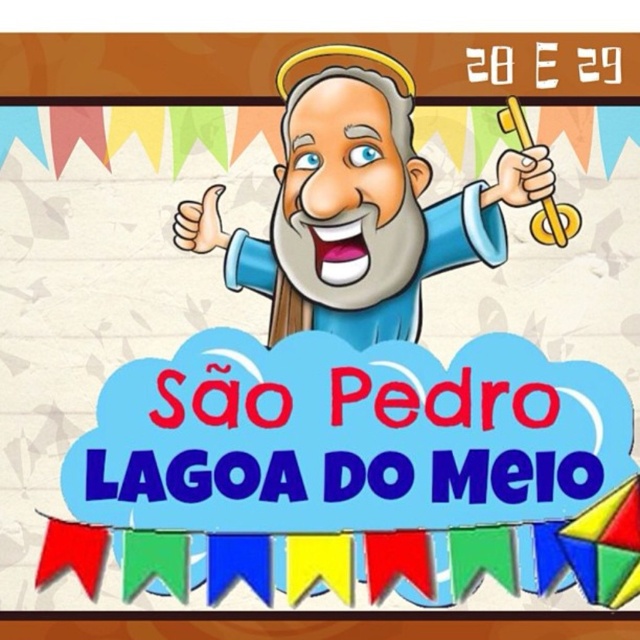
Between cartoon blue robe at center and gold metallic key at upper right, which one appears on the left side from the viewer's perspective?

cartoon blue robe at center

Can you confirm if cartoon blue robe at center is taller than gold metallic key at upper right?

Correct, cartoon blue robe at center is much taller as gold metallic key at upper right.

Locate an element on the screen. The image size is (640, 640). cartoon blue robe at center is located at coordinates (358, 208).

Which of these two, blue matte/soft robe at center or gold metallic key at upper right, stands taller?

Standing taller between the two is blue matte/soft robe at center.

Is blue matte/soft robe at center above gold metallic key at upper right?

No.

Who is more forward, (x=422, y=211) or (x=540, y=243)?

Point (x=540, y=243) is in front.

This screenshot has height=640, width=640. In order to click on blue matte/soft robe at center in this screenshot , I will do `click(422, 269)`.

Between cartoon blue robe at center and blue matte/soft robe at center, which one appears on the left side from the viewer's perspective?

cartoon blue robe at center

Between cartoon blue robe at center and blue matte/soft robe at center, which one has more height?

Standing taller between the two is cartoon blue robe at center.

Image resolution: width=640 pixels, height=640 pixels. Identify the location of cartoon blue robe at center. (358, 208).